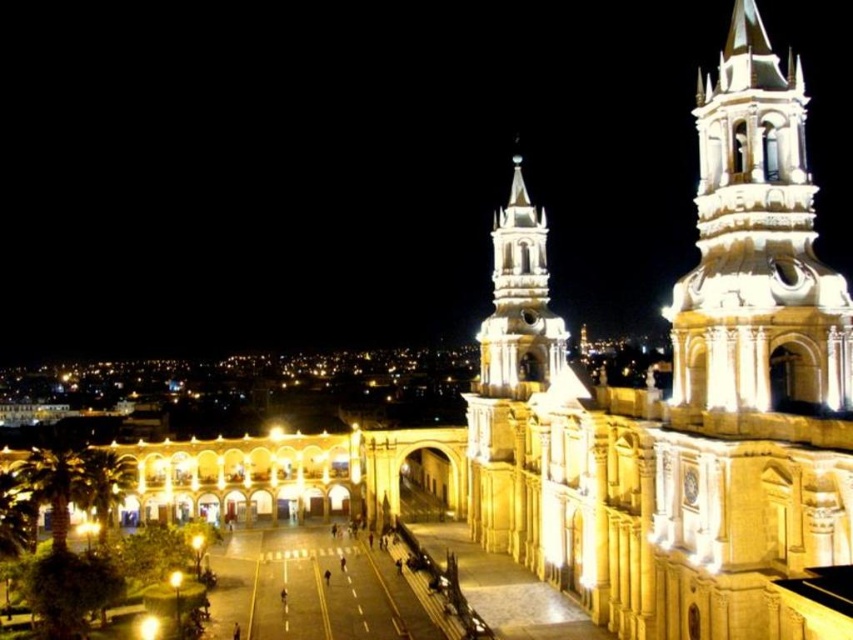
Question: Can you confirm if white stone tower at upper right is bigger than white stone tower at center?

Choices:
 (A) no
 (B) yes

Answer: (A)

Question: Which of the following is the closest to the observer?

Choices:
 (A) (521, 321)
 (B) (779, 186)

Answer: (B)

Question: Which object is farther from the camera taking this photo?

Choices:
 (A) white stone tower at upper right
 (B) white stone tower at center

Answer: (B)

Question: Is white stone tower at upper right further to the viewer compared to white stone tower at center?

Choices:
 (A) no
 (B) yes

Answer: (A)

Question: Considering the relative positions of white stone tower at upper right and white stone tower at center in the image provided, where is white stone tower at upper right located with respect to white stone tower at center?

Choices:
 (A) below
 (B) above

Answer: (A)